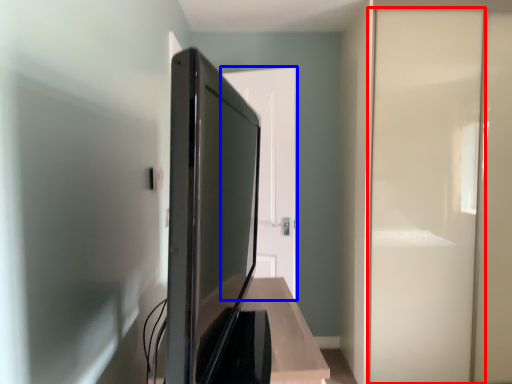
Question: Which object is further to the camera taking this photo, screen door (highlighted by a red box) or door (highlighted by a blue box)?

Choices:
 (A) screen door
 (B) door

Answer: (B)